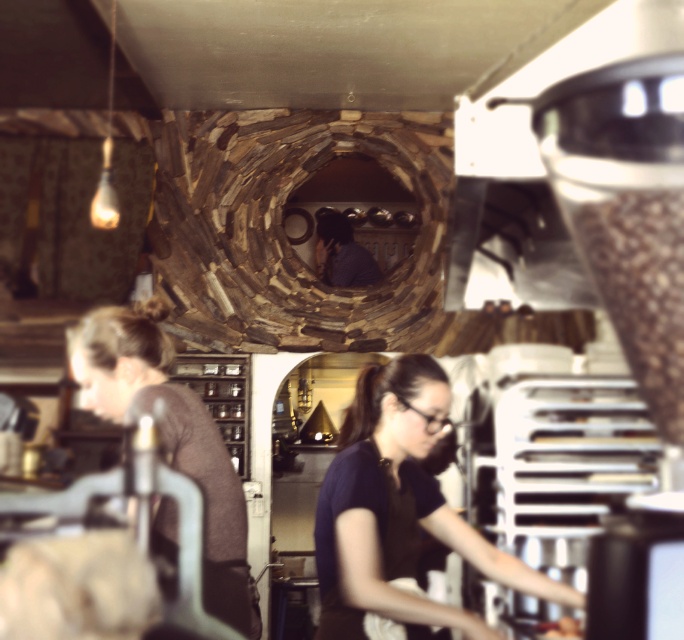
Question: Which point is closer to the camera taking this photo?

Choices:
 (A) (324, 548)
 (B) (166, 358)

Answer: (A)

Question: Is black matte apron at lower center in front of matte brown hair at left?

Choices:
 (A) no
 (B) yes

Answer: (A)

Question: Which object appears farthest from the camera in this image?

Choices:
 (A) matte brown hair at left
 (B) black matte apron at lower center

Answer: (B)

Question: Is black matte apron at lower center thinner than matte brown hair at left?

Choices:
 (A) no
 (B) yes

Answer: (A)

Question: Does black matte apron at lower center have a smaller size compared to matte brown hair at left?

Choices:
 (A) no
 (B) yes

Answer: (B)